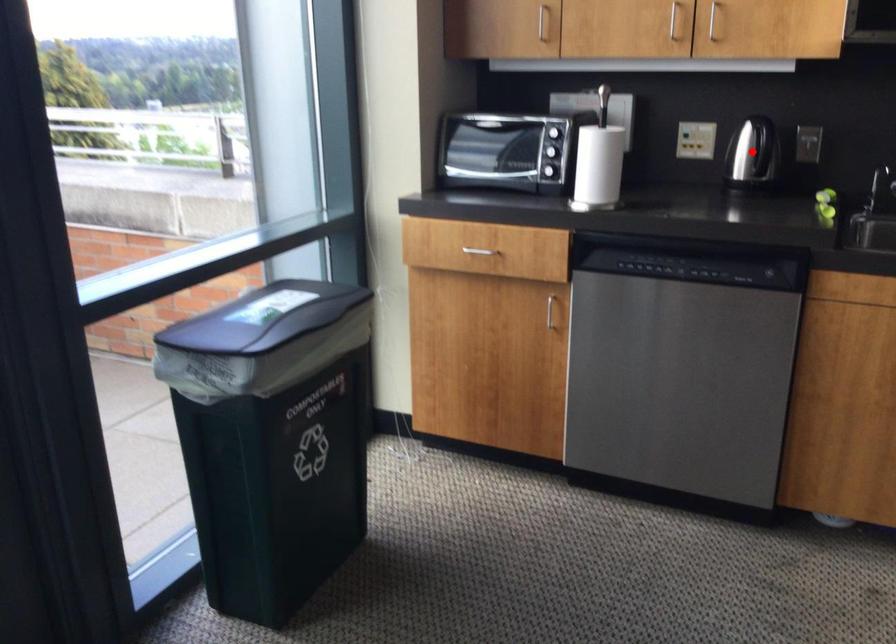
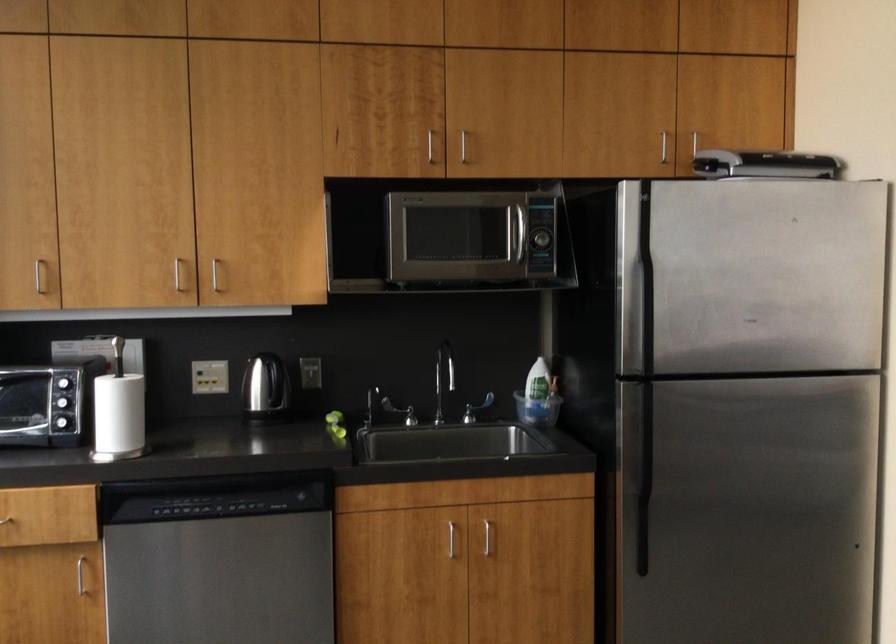
Question: I am providing you with two images of the same scene from different viewpoints. Image1 has a red point marked. In image2, the corresponding 3D location appears at what relative position? Reply with the corresponding letter.

Choices:
 (A) Closer
 (B) Farther

Answer: (B)